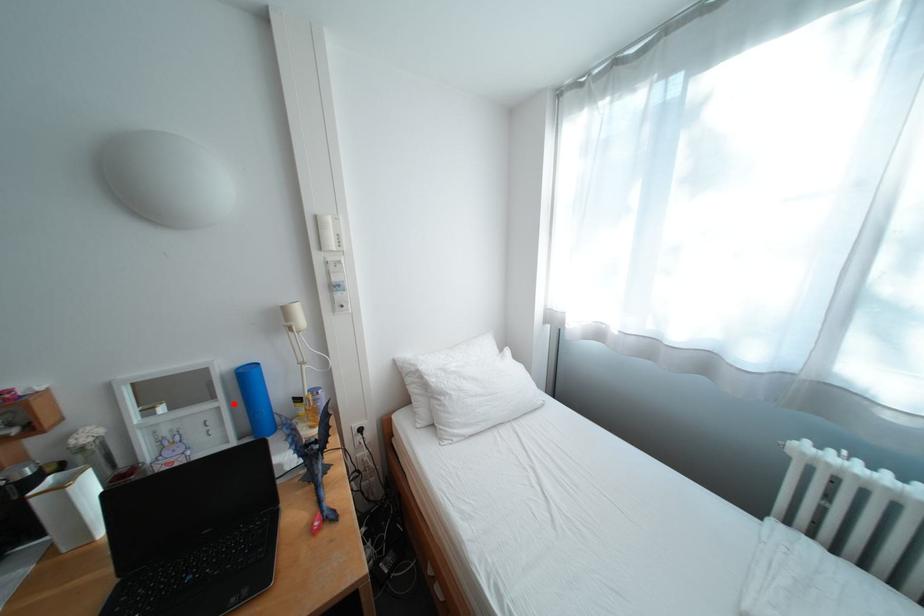
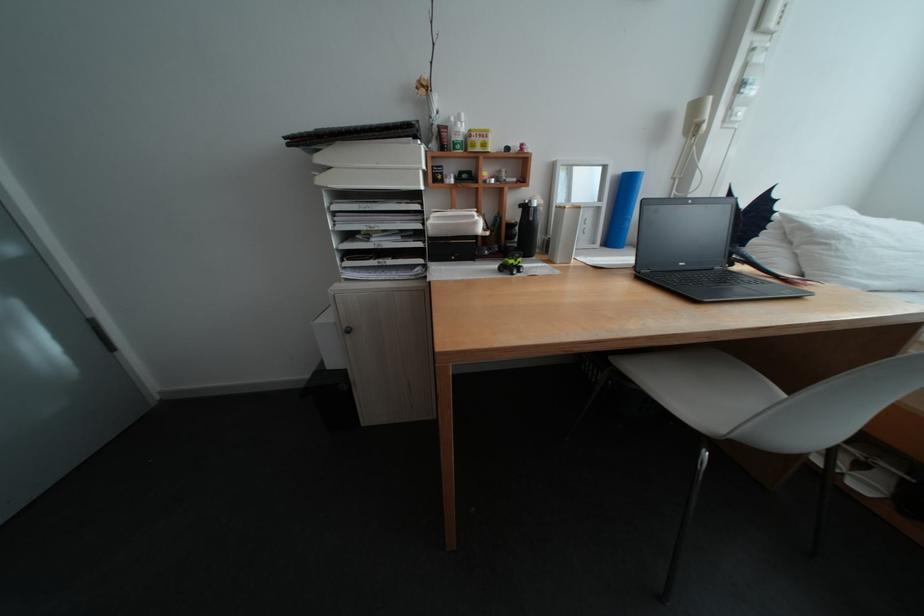
In the second image, find the point that corresponds to the highlighted location in the first image.

(616, 205)